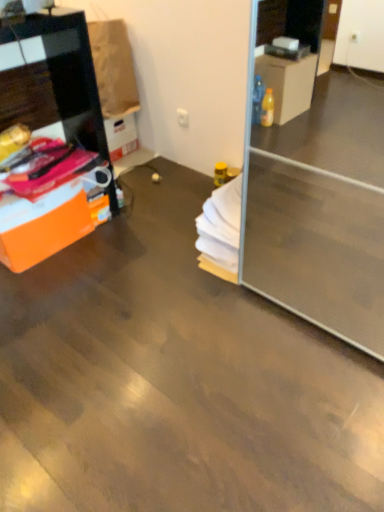
This screenshot has width=384, height=512. I want to click on orange matte cardboard box at left, so click(x=42, y=226).

Describe the element at coordinates (42, 226) in the screenshot. I see `orange matte cardboard box at left` at that location.

You are a GUI agent. You are given a task and a screenshot of the screen. Output one action in this format:
    pyautogui.click(x=<x>, y=<y>)
    Task: Click on the orange matte cardboard box at left
    This screenshot has width=384, height=512.
    Given the screenshot: What is the action you would take?
    pyautogui.click(x=42, y=226)